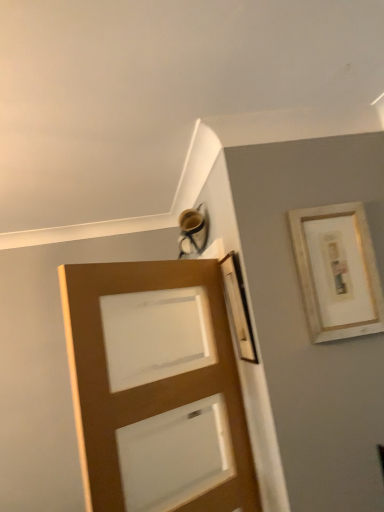
Question: Should I look upward or downward to see gold-framed artwork at upper right?

Choices:
 (A) up
 (B) down

Answer: (B)

Question: From a real-world perspective, is brown matte door at center located beneath gold-framed artwork at upper right?

Choices:
 (A) no
 (B) yes

Answer: (B)

Question: Can you confirm if brown matte door at center is positioned to the left of gold-framed artwork at upper right?

Choices:
 (A) yes
 (B) no

Answer: (A)

Question: From the image's perspective, is brown matte door at center located beneath gold-framed artwork at upper right?

Choices:
 (A) no
 (B) yes

Answer: (B)

Question: Is brown matte door at center in front of gold-framed artwork at upper right?

Choices:
 (A) no
 (B) yes

Answer: (B)

Question: Considering the relative sizes of brown matte door at center and gold-framed artwork at upper right in the image provided, is brown matte door at center smaller than gold-framed artwork at upper right?

Choices:
 (A) yes
 (B) no

Answer: (B)

Question: Can gold-framed artwork at upper right be found inside brown matte door at center?

Choices:
 (A) no
 (B) yes

Answer: (A)

Question: Is gold-framed artwork at upper right outside of brown matte door at center?

Choices:
 (A) yes
 (B) no

Answer: (A)

Question: Considering the relative sizes of gold-framed artwork at upper right and brown matte door at center in the image provided, is gold-framed artwork at upper right bigger than brown matte door at center?

Choices:
 (A) yes
 (B) no

Answer: (B)

Question: Is gold-framed artwork at upper right at the right side of brown matte door at center?

Choices:
 (A) no
 (B) yes

Answer: (B)

Question: Does gold-framed artwork at upper right have a greater width compared to brown matte door at center?

Choices:
 (A) no
 (B) yes

Answer: (A)

Question: From the image's perspective, is gold-framed artwork at upper right located beneath brown matte door at center?

Choices:
 (A) no
 (B) yes

Answer: (A)

Question: Are gold-framed artwork at upper right and brown matte door at center making contact?

Choices:
 (A) yes
 (B) no

Answer: (B)

Question: Would you say brown matte door at center is inside or outside gold-framed artwork at upper right?

Choices:
 (A) inside
 (B) outside

Answer: (B)